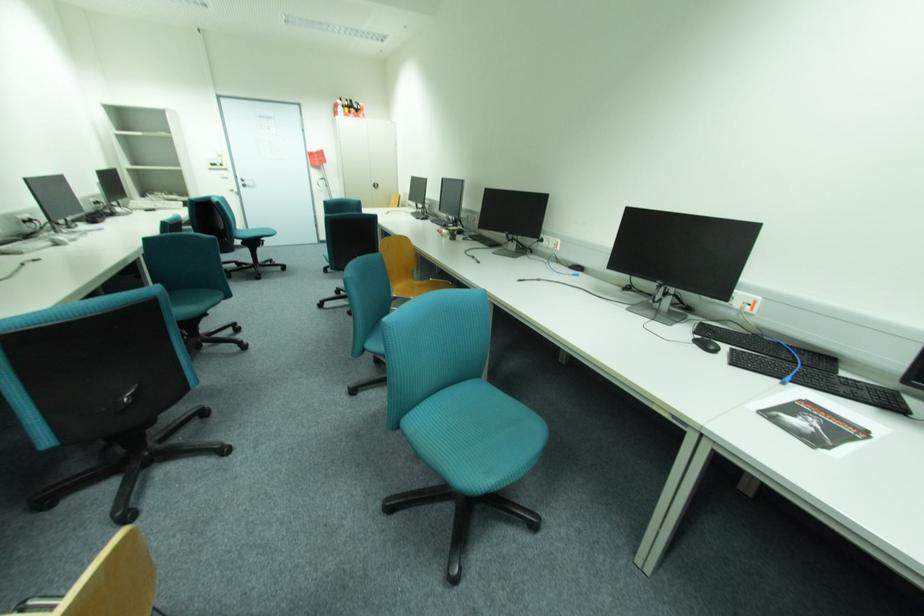
Where would you pull the silver door handle? Please return your answer as a coordinate pair (x, y).

(246, 182)